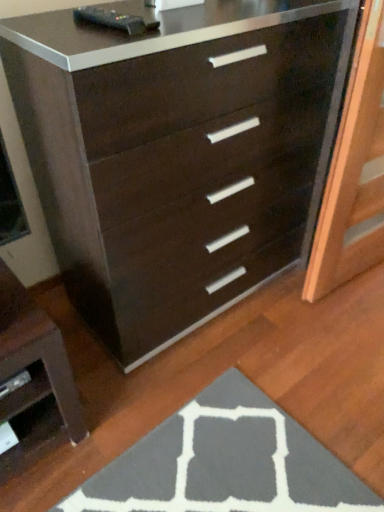
Locate an element on the screen. Image resolution: width=384 pixels, height=512 pixels. dark wood chest of drawers at center is located at coordinates (178, 154).

Measure the distance between point (161, 164) and camera.

Point (161, 164) is 3.62 feet away from camera.

Measure the distance between dark wood chest of drawers at center and camera.

The distance of dark wood chest of drawers at center from camera is 32.77 inches.

What do you see at coordinates (178, 154) in the screenshot? The width and height of the screenshot is (384, 512). I see `dark wood chest of drawers at center` at bounding box center [178, 154].

Identify the location of dark wood chest of drawers at center. (178, 154).